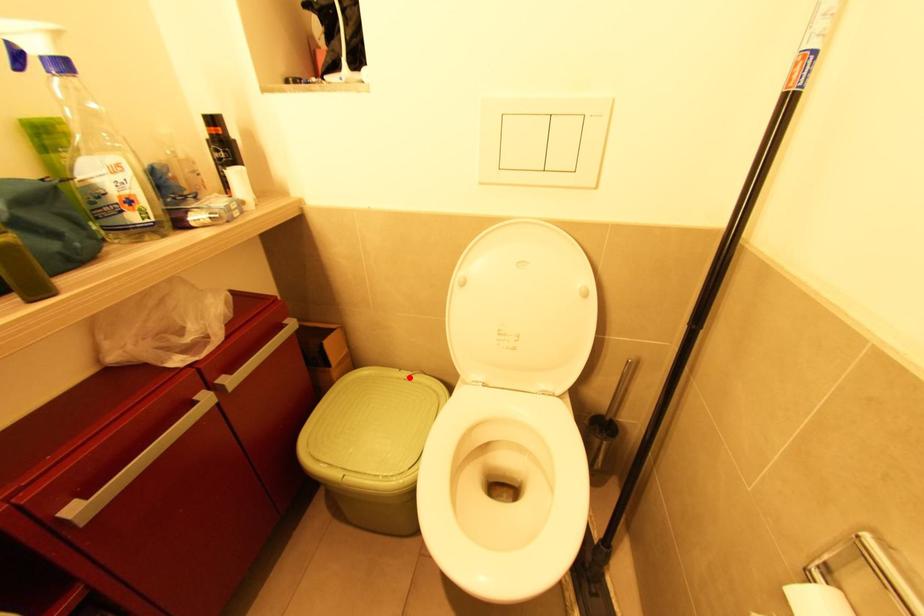
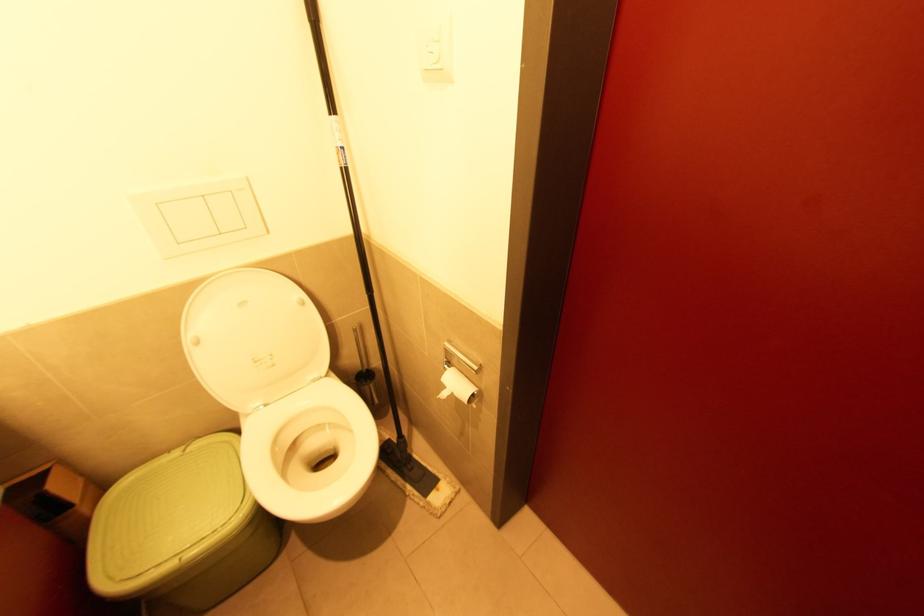
In the second image, find the point that corresponds to the highlighted location in the first image.

(187, 452)